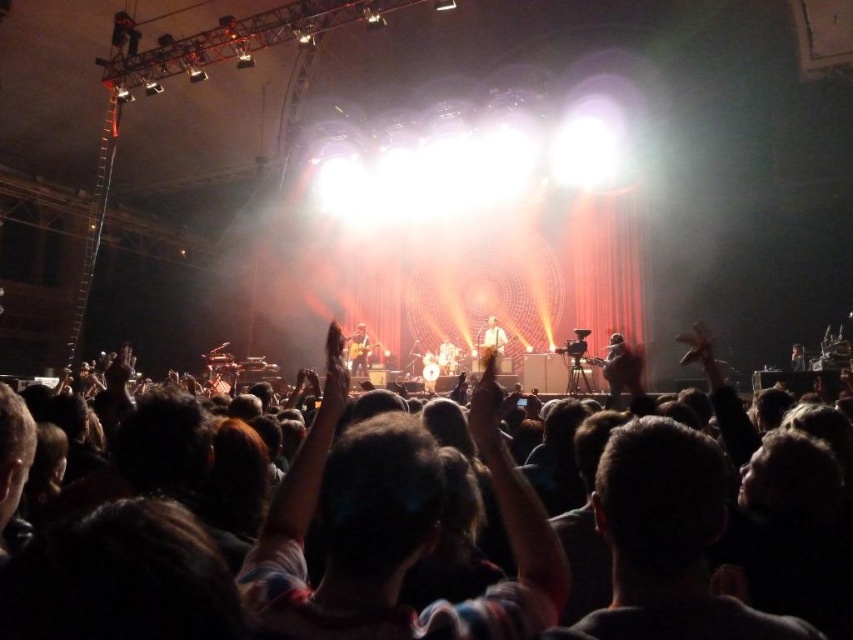
Between light brown leather guitar at center and matte black guitar at center, which one is positioned higher?

light brown leather guitar at center is above.

Is light brown leather guitar at center above matte black guitar at center?

Yes, light brown leather guitar at center is above matte black guitar at center.

Does point (488, 342) come behind point (363, 369)?

That is False.

Where is `light brown leather guitar at center`? light brown leather guitar at center is located at coordinates (492, 342).